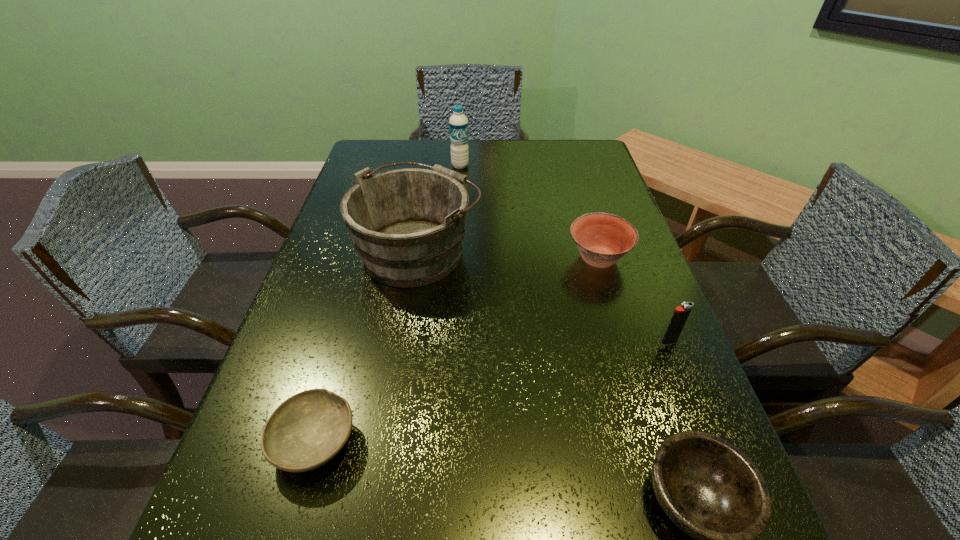
Identify which bowl is the nearest to the shortest bowl. Please provide its 2D coordinates. Your answer should be formatted as a tuple, i.e. [(x, y)], where the tuple contains the x and y coordinates of a point satisfying the conditions above.

[(707, 487)]

Where is `the second closest bowl to the tallest bowl`? the second closest bowl to the tallest bowl is located at coordinates (306, 431).

Locate an element on the screen. free spot that satisfies the following two spatial constraints: 1. on the label of the fourth farthest object; 2. on the left side of the farthest object is located at coordinates (448, 342).